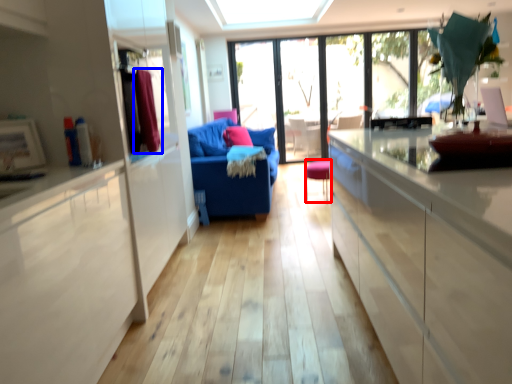
Question: Which object appears farthest to the camera in this image, chair (highlighted by a red box) or curtain (highlighted by a blue box)?

Choices:
 (A) chair
 (B) curtain

Answer: (A)